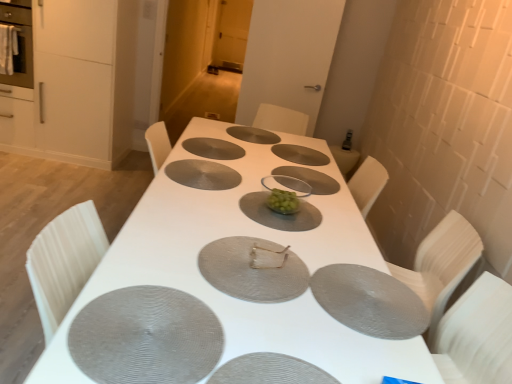
You are a GUI agent. You are given a task and a screenshot of the screen. Output one action in this format:
    pyautogui.click(x=<x>, y=<y>)
    Task: Click on the vacant area that is in front of matte gray pizza pan at center, which appears as the sixth pizza pan when viewed from the front
    The image size is (512, 384).
    Given the screenshot: What is the action you would take?
    pyautogui.click(x=216, y=166)